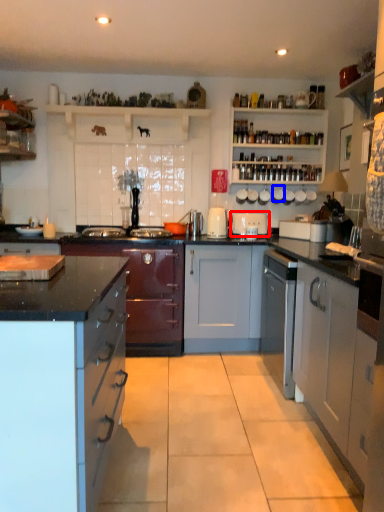
Question: Which object appears farthest to the camera in this image, appliance (highlighted by a red box) or appliance (highlighted by a blue box)?

Choices:
 (A) appliance
 (B) appliance

Answer: (B)